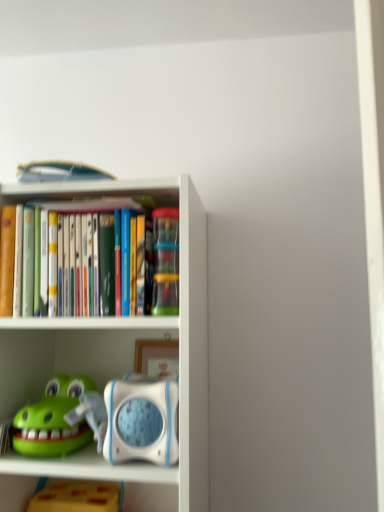
Question: Is translucent plastic containers at center, the 1th toy when ordered from top to bottom, shorter than green rubber toy at lower left, which is counted as the second toy, starting from the bottom?

Choices:
 (A) yes
 (B) no

Answer: (B)

Question: Is green rubber toy at lower left, acting as the second toy starting from the top, completely or partially inside translucent plastic containers at center, positioned as the 3th toy in bottom-to-top order?

Choices:
 (A) yes
 (B) no

Answer: (B)

Question: From a real-world perspective, is translucent plastic containers at center, positioned as the 3th toy in bottom-to-top order, over green rubber toy at lower left, which is counted as the second toy, starting from the bottom?

Choices:
 (A) no
 (B) yes

Answer: (B)

Question: From a real-world perspective, does translucent plastic containers at center, the 1th toy when ordered from top to bottom, sit lower than green rubber toy at lower left, which is counted as the second toy, starting from the bottom?

Choices:
 (A) yes
 (B) no

Answer: (B)

Question: Is translucent plastic containers at center, positioned as the 3th toy in bottom-to-top order, taller than green rubber toy at lower left, which is counted as the second toy, starting from the bottom?

Choices:
 (A) yes
 (B) no

Answer: (A)

Question: From their relative heights in the image, would you say translucent plastic containers at center, the 1th toy when ordered from top to bottom, is taller or shorter than green rubber toy at lower left, which is counted as the second toy, starting from the bottom?

Choices:
 (A) short
 (B) tall

Answer: (B)

Question: Is point (173, 228) closer or farther from the camera than point (71, 402)?

Choices:
 (A) closer
 (B) farther

Answer: (A)

Question: Looking at their shapes, would you say translucent plastic containers at center, positioned as the 3th toy in bottom-to-top order, is wider or thinner than green rubber toy at lower left, acting as the second toy starting from the top?

Choices:
 (A) wide
 (B) thin

Answer: (B)

Question: From a real-world perspective, relative to green rubber toy at lower left, which is counted as the second toy, starting from the bottom, is translucent plastic containers at center, the 1th toy when ordered from top to bottom, vertically above or below?

Choices:
 (A) below
 (B) above

Answer: (B)

Question: From a real-world perspective, is green rubber toy at lower left, acting as the second toy starting from the top, above or below white plastic shelf at center?

Choices:
 (A) above
 (B) below

Answer: (B)

Question: In terms of height, does green rubber toy at lower left, which is counted as the second toy, starting from the bottom, look taller or shorter compared to white plastic shelf at center?

Choices:
 (A) short
 (B) tall

Answer: (A)

Question: In the image, is green rubber toy at lower left, acting as the second toy starting from the top, positioned in front of or behind white plastic shelf at center?

Choices:
 (A) behind
 (B) front

Answer: (A)

Question: Is point (18, 413) closer or farther from the camera than point (185, 322)?

Choices:
 (A) closer
 (B) farther

Answer: (B)

Question: Considering the positions of translucent plastic containers at center, the 1th toy when ordered from top to bottom, and white plastic shelf at center in the image, is translucent plastic containers at center, the 1th toy when ordered from top to bottom, taller or shorter than white plastic shelf at center?

Choices:
 (A) short
 (B) tall

Answer: (A)

Question: In terms of size, does translucent plastic containers at center, positioned as the 3th toy in bottom-to-top order, appear bigger or smaller than white plastic shelf at center?

Choices:
 (A) big
 (B) small

Answer: (B)